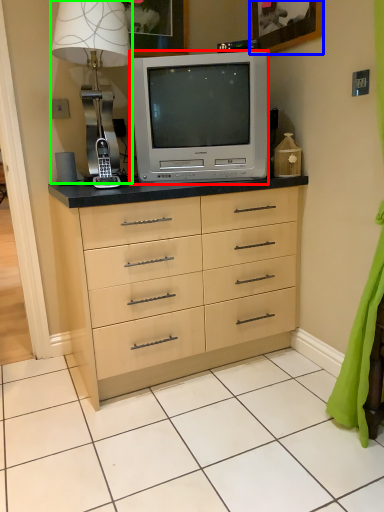
Question: Which object is positioned farthest from television (highlighted by a red box)? Select from picture frame (highlighted by a blue box) and table lamp (highlighted by a green box).

Choices:
 (A) picture frame
 (B) table lamp

Answer: (A)